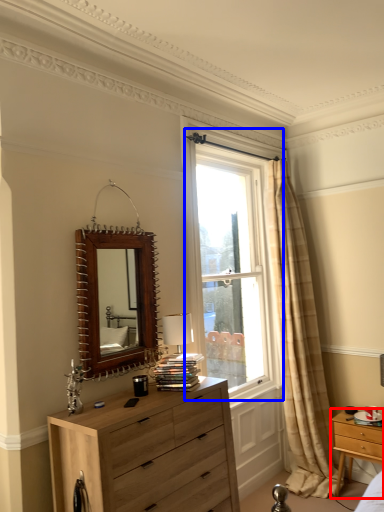
Question: Which object appears farthest to the camera in this image, nightstand (highlighted by a red box) or window (highlighted by a blue box)?

Choices:
 (A) nightstand
 (B) window

Answer: (B)